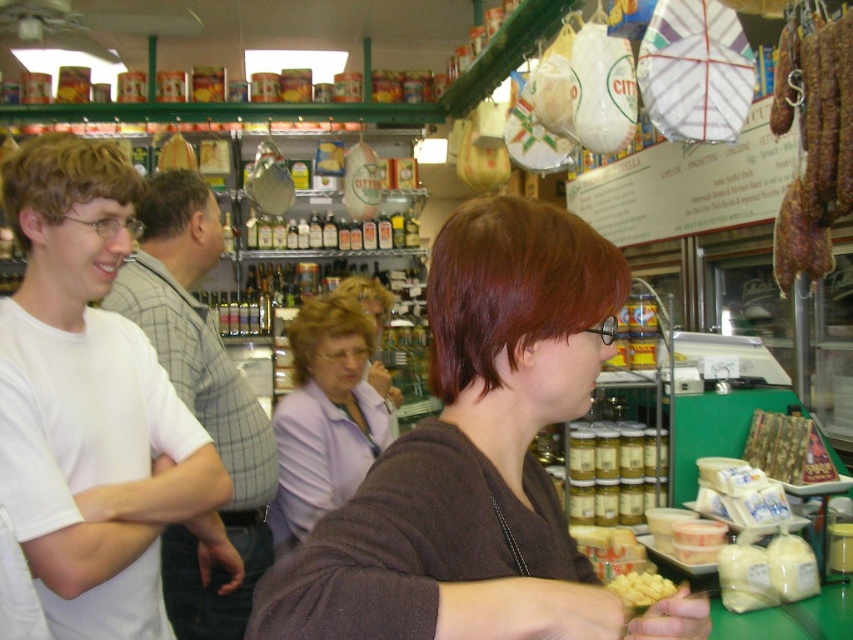
Question: Which point is closer to the camera?

Choices:
 (A) white t-shirt at left
 (B) white shirt at left

Answer: (A)

Question: Which of the following is the closest to the observer?

Choices:
 (A) (35, 492)
 (B) (666, 584)
 (C) (241, 451)

Answer: (A)

Question: Can you confirm if white shirt at left is positioned to the right of yellow cheese at center?

Choices:
 (A) no
 (B) yes

Answer: (A)

Question: Is brown matte shirt at center further to the viewer compared to brown leather sausage at right?

Choices:
 (A) no
 (B) yes

Answer: (A)

Question: Which point is closer to the camera taking this photo?

Choices:
 (A) (311, 440)
 (B) (265, 452)
 (C) (801, 81)
 (D) (74, 180)

Answer: (D)

Question: Does white shirt at left have a smaller size compared to purple fabric shirt at center?

Choices:
 (A) yes
 (B) no

Answer: (B)